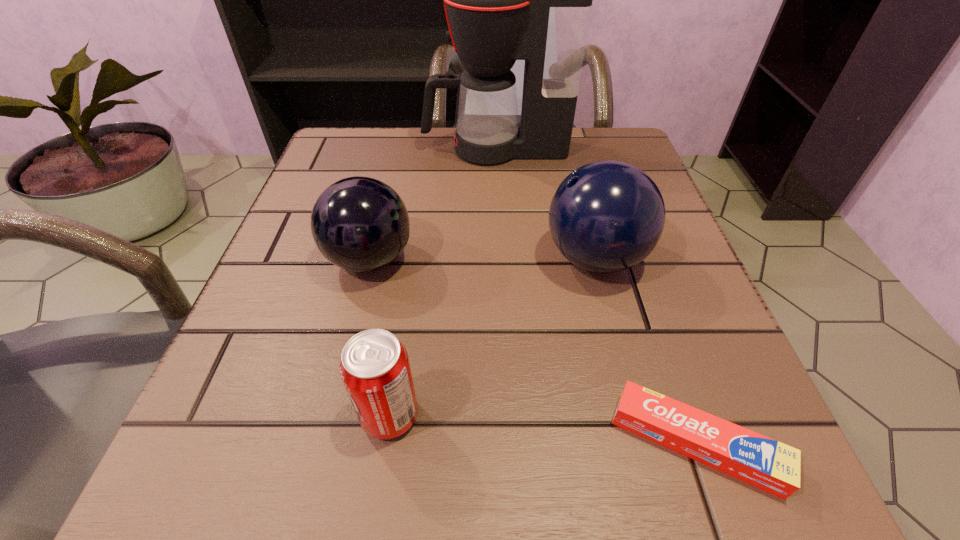
The width and height of the screenshot is (960, 540). I want to click on free space that satisfies the following two spatial constraints: 1. on the back side of the toothpaste; 2. on the surface of the right bowling ball near the finger holes, so click(x=632, y=258).

The height and width of the screenshot is (540, 960). I want to click on vacant region that satisfies the following two spatial constraints: 1. on the surface of the toothpaste near the finger holes; 2. on the left side of the right bowling ball, so click(643, 443).

This screenshot has width=960, height=540. Identify the location of vacant space that satisfies the following two spatial constraints: 1. on the side of the shorter bowling ball with the finger holes; 2. on the right side of the toothpaste. (324, 443).

Locate an element on the screen. The image size is (960, 540). free spot that satisfies the following two spatial constraints: 1. on the back side of the shortest object; 2. on the surface of the right bowling ball near the finger holes is located at coordinates (632, 258).